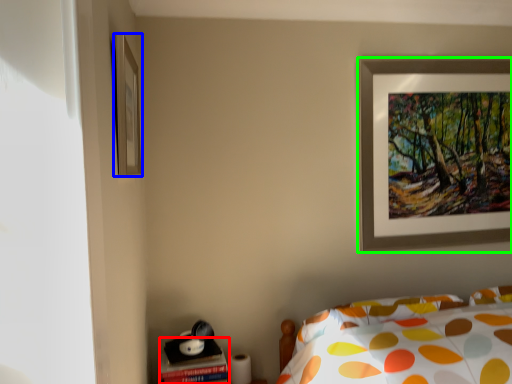
Question: Considering the real-world distances, which object is closest to table (highlighted by a red box)? picture frame (highlighted by a blue box) or picture frame (highlighted by a green box).

Choices:
 (A) picture frame
 (B) picture frame

Answer: (A)